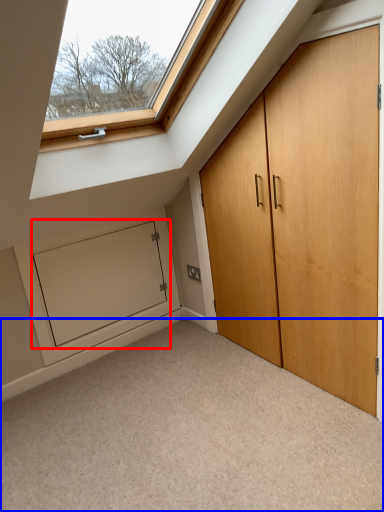
Question: Which point is further to the camera, screen door (highlighted by a red box) or corridor (highlighted by a blue box)?

Choices:
 (A) screen door
 (B) corridor

Answer: (A)